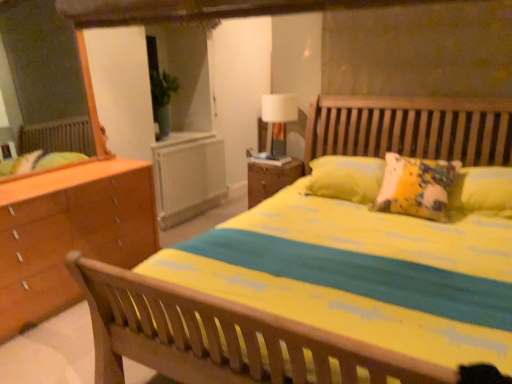
Image resolution: width=512 pixels, height=384 pixels. Describe the element at coordinates (188, 175) in the screenshot. I see `white plastic radiator at center` at that location.

You are a GUI agent. You are given a task and a screenshot of the screen. Output one action in this format:
    pyautogui.click(x=<x>, y=<y>)
    Task: Click on the white fabric-covered lamp at upper center
    This screenshot has height=384, width=512.
    Given the screenshot: What is the action you would take?
    pyautogui.click(x=278, y=121)

Considering the relative sizes of white plastic radiator at center and white fabric-covered lamp at upper center in the image provided, is white plastic radiator at center smaller than white fabric-covered lamp at upper center?

No.

From a real-world perspective, is white plastic radiator at center located beneath white fabric-covered lamp at upper center?

Yes, from a real-world perspective, white plastic radiator at center is beneath white fabric-covered lamp at upper center.

What's the angular difference between white plastic radiator at center and white fabric-covered lamp at upper center's facing directions?

91.8 degrees.

In the scene shown: Choose the correct answer: Is white plastic radiator at center inside white fabric-covered lamp at upper center or outside it?

white plastic radiator at center is not enclosed by white fabric-covered lamp at upper center.

Does white plastic radiator at center have a lesser height compared to wooden nightstand at center?

No.

Which is closer, (177, 204) or (267, 163)?

Point (267, 163)

Does white plastic radiator at center turn towards wooden nightstand at center?

Yes, white plastic radiator at center is oriented towards wooden nightstand at center.

Considering the relative positions of white plastic radiator at center and wooden nightstand at center in the image provided, is white plastic radiator at center in front of wooden nightstand at center?

No, white plastic radiator at center is further to the viewer.

Can you confirm if white fabric-covered lamp at upper center is positioned to the left of wooden nightstand at center?

No.

Could you tell me if white fabric-covered lamp at upper center is turned towards wooden nightstand at center?

No, white fabric-covered lamp at upper center is not aimed at wooden nightstand at center.

Is white fabric-covered lamp at upper center taller or shorter than wooden nightstand at center?

In the image, white fabric-covered lamp at upper center appears to be taller than wooden nightstand at center.

Which of these two, wooden nightstand at center or white fabric-covered lamp at upper center, stands taller?

Standing taller between the two is white fabric-covered lamp at upper center.

Where is `nightstand that appears on the left of white fabric-covered lamp at upper center`? This screenshot has width=512, height=384. nightstand that appears on the left of white fabric-covered lamp at upper center is located at coordinates (270, 177).

Is wooden nightstand at center at the right side of white fabric-covered lamp at upper center?

Incorrect, wooden nightstand at center is not on the right side of white fabric-covered lamp at upper center.

Is point (258, 160) less distant than point (287, 106)?

Yes, point (258, 160) is in front of point (287, 106).

Looking at this image, is white fabric-covered lamp at upper center touching white plastic radiator at center?

No, white fabric-covered lamp at upper center is not next to white plastic radiator at center.

From a real-world perspective, is white fabric-covered lamp at upper center over white plastic radiator at center?

Yes.

Between white fabric-covered lamp at upper center and white plastic radiator at center, which one appears on the right side from the viewer's perspective?

Positioned to the right is white fabric-covered lamp at upper center.

Considering the sizes of objects white fabric-covered lamp at upper center and white plastic radiator at center in the image provided, who is taller, white fabric-covered lamp at upper center or white plastic radiator at center?

Standing taller between the two is white plastic radiator at center.

Is point (254, 172) more distant than point (188, 172)?

No, it is in front of (188, 172).

Which of these two, wooden nightstand at center or white plastic radiator at center, is bigger?

With larger size is wooden nightstand at center.

Measure the distance from wooden nightstand at center to white plastic radiator at center.

They are 35.60 inches apart.

From a real-world perspective, which is physically above, wooden nightstand at center or white plastic radiator at center?

wooden nightstand at center.

The width and height of the screenshot is (512, 384). Find the location of `table lamp in front of the white plastic radiator at center`. table lamp in front of the white plastic radiator at center is located at coordinates (278, 121).

Find the location of `nightstand on the right of white plastic radiator at center`. nightstand on the right of white plastic radiator at center is located at coordinates (270, 177).

When comparing their distances from wooden nightstand at center, does white fabric-covered lamp at upper center or white plastic radiator at center seem further?

white plastic radiator at center lies further to wooden nightstand at center than the other object.

Based on their spatial positions, is wooden nightstand at center or white plastic radiator at center closer to white fabric-covered lamp at upper center?

The object closer to white fabric-covered lamp at upper center is wooden nightstand at center.

Which object lies nearer to the anchor point white plastic radiator at center, white fabric-covered lamp at upper center or wooden nightstand at center?

wooden nightstand at center lies closer to white plastic radiator at center than the other object.

Looking at the image, which one is located further to wooden nightstand at center, white plastic radiator at center or white fabric-covered lamp at upper center?

white plastic radiator at center is positioned further to the anchor wooden nightstand at center.

Consider the image. Considering their positions, is wooden nightstand at center positioned closer to white plastic radiator at center than white fabric-covered lamp at upper center?

Based on the image, wooden nightstand at center appears to be nearer to white plastic radiator at center.

Consider the image. Based on their spatial positions, is white plastic radiator at center or wooden nightstand at center further from white fabric-covered lamp at upper center?

white plastic radiator at center is positioned further to the anchor white fabric-covered lamp at upper center.

Find the location of a particular element. nightstand between white plastic radiator at center and white fabric-covered lamp at upper center is located at coordinates (270, 177).